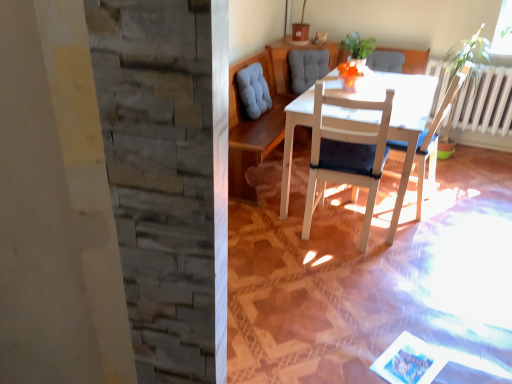
Locate an element on the screen. Image resolution: width=512 pixels, height=384 pixels. white wood table at center is located at coordinates (406, 110).

Where is `white wood chair at center, which appears as the 1th chair when viewed from the right`? The image size is (512, 384). white wood chair at center, which appears as the 1th chair when viewed from the right is located at coordinates (435, 136).

What is the approximate width of green leafy plant at upper center?

green leafy plant at upper center is 10.26 inches wide.

Identify the location of white wood table at center. (406, 110).

Does white wood table at center contain green leafy plant at upper center?

No, white wood table at center does not contain green leafy plant at upper center.

Is white wood table at center aimed at green leafy plant at upper center?

No, white wood table at center is not turned towards green leafy plant at upper center.

How much distance is there between white wood chair at center, which is counted as the first chair, starting from the left, and white wood table at center?

They are 8.35 inches apart.

Is white wood chair at center, which is counted as the first chair, starting from the left, taller than white wood table at center?

Indeed, white wood chair at center, which is counted as the first chair, starting from the left, has a greater height compared to white wood table at center.

From the image's perspective, between white wood chair at center, which is counted as the first chair, starting from the left, and white wood table at center, which one is located above?

white wood table at center.

Between white wood chair at center, which is counted as the first chair, starting from the left, and white wood table at center, which one is positioned behind?

white wood table at center is further from the camera.

Is white wood table at center in contact with white wood chair at center, acting as the second chair starting from the left?

No, white wood table at center is not with white wood chair at center, acting as the second chair starting from the left.

Which is more to the left, white wood table at center or white wood chair at center, which appears as the 1th chair when viewed from the right?

white wood table at center.

From a real-world perspective, between white wood table at center and white wood chair at center, acting as the second chair starting from the left, who is vertically lower?

white wood table at center.

Considering their positions, is white wood table at center located in front of or behind white wood chair at center, which appears as the 1th chair when viewed from the right?

Visually, white wood table at center is located in front of white wood chair at center, which appears as the 1th chair when viewed from the right.

Considering the relative positions of white wood chair at center, placed as the second chair when sorted from right to left, and white wood chair at center, acting as the second chair starting from the left, in the image provided, is white wood chair at center, placed as the second chair when sorted from right to left, to the left or to the right of white wood chair at center, acting as the second chair starting from the left,?

white wood chair at center, placed as the second chair when sorted from right to left, is to the left of white wood chair at center, acting as the second chair starting from the left.

Is white wood chair at center, which is counted as the first chair, starting from the left, bigger than white wood chair at center, which appears as the 1th chair when viewed from the right?

Yes.

Measure the distance between white wood chair at center, which is counted as the first chair, starting from the left, and white wood chair at center, acting as the second chair starting from the left.

A distance of 17.53 inches exists between white wood chair at center, which is counted as the first chair, starting from the left, and white wood chair at center, acting as the second chair starting from the left.

Is white wood chair at center, which is counted as the first chair, starting from the left, far away from white wood chair at center, acting as the second chair starting from the left?

white wood chair at center, which is counted as the first chair, starting from the left, is near white wood chair at center, acting as the second chair starting from the left, not far away.

From the image's perspective, which one is positioned higher, green leafy plant at upper center or white wood chair at center, acting as the second chair starting from the left?

green leafy plant at upper center, from the image's perspective.

From a real-world perspective, is green leafy plant at upper center over white wood chair at center, acting as the second chair starting from the left?

Yes, from a real-world perspective, green leafy plant at upper center is above white wood chair at center, acting as the second chair starting from the left.

What are the coordinates of `the 1st chair below the green leafy plant at upper center (from the image's perspective)` in the screenshot? It's located at pos(435,136).

Is white wood chair at center, which appears as the 1th chair when viewed from the right, located outside green leafy plant at upper center?

white wood chair at center, which appears as the 1th chair when viewed from the right, is positioned outside green leafy plant at upper center.

From a real-world perspective, does white wood chair at center, which appears as the 1th chair when viewed from the right, sit lower than green leafy plant at upper center?

Indeed, from a real-world perspective, white wood chair at center, which appears as the 1th chair when viewed from the right, is positioned beneath green leafy plant at upper center.

Is the depth of white wood table at center greater than that of white wood chair at center, placed as the second chair when sorted from right to left?

Yes.

Can you confirm if white wood table at center is thinner than white wood chair at center, which is counted as the first chair, starting from the left?

Incorrect, the width of white wood table at center is not less than that of white wood chair at center, which is counted as the first chair, starting from the left.

Can you confirm if white wood table at center is taller than white wood chair at center, which is counted as the first chair, starting from the left?

In fact, white wood table at center may be shorter than white wood chair at center, which is counted as the first chair, starting from the left.

Where is `table below the green leafy plant at upper center (from a real-world perspective)`? This screenshot has width=512, height=384. table below the green leafy plant at upper center (from a real-world perspective) is located at coordinates (406, 110).

Image resolution: width=512 pixels, height=384 pixels. Find the location of `table on the right of the white wood chair at center, placed as the second chair when sorted from right to left`. table on the right of the white wood chair at center, placed as the second chair when sorted from right to left is located at coordinates (406, 110).

Estimate the real-world distances between objects in this image. Which object is closer to white wood table at center, green leafy plant at upper center or white wood chair at center, which appears as the 1th chair when viewed from the right?

white wood chair at center, which appears as the 1th chair when viewed from the right, is positioned closer to the anchor white wood table at center.

From the image, which object appears to be farther from white wood chair at center, acting as the second chair starting from the left, white wood chair at center, placed as the second chair when sorted from right to left, or white wood table at center?

white wood chair at center, placed as the second chair when sorted from right to left, is positioned further to the anchor white wood chair at center, acting as the second chair starting from the left.

Estimate the real-world distances between objects in this image. Which object is closer to white wood table at center, white wood chair at center, acting as the second chair starting from the left, or green leafy plant at upper center?

white wood chair at center, acting as the second chair starting from the left, is positioned closer to the anchor white wood table at center.

Looking at the image, which one is located further to white wood chair at center, which appears as the 1th chair when viewed from the right, white wood table at center or white wood chair at center, placed as the second chair when sorted from right to left?

The object further to white wood chair at center, which appears as the 1th chair when viewed from the right, is white wood chair at center, placed as the second chair when sorted from right to left.

When comparing their distances from green leafy plant at upper center, does white wood chair at center, placed as the second chair when sorted from right to left, or white wood table at center seem closer?

white wood table at center lies closer to green leafy plant at upper center than the other object.

Based on their spatial positions, is white wood chair at center, acting as the second chair starting from the left, or white wood table at center closer to white wood chair at center, which is counted as the first chair, starting from the left?

Based on the image, white wood table at center appears to be nearer to white wood chair at center, which is counted as the first chair, starting from the left.

Based on their spatial positions, is green leafy plant at upper center or white wood chair at center, placed as the second chair when sorted from right to left, further from white wood table at center?

green leafy plant at upper center is positioned further to the anchor white wood table at center.

Based on their spatial positions, is white wood chair at center, which appears as the 1th chair when viewed from the right, or white wood chair at center, which is counted as the first chair, starting from the left, further from white wood table at center?

white wood chair at center, which appears as the 1th chair when viewed from the right, is further to white wood table at center.

This screenshot has height=384, width=512. What are the coordinates of `chair between white wood chair at center, which is counted as the first chair, starting from the left, and green leafy plant at upper center in the front-back direction` in the screenshot? It's located at (435, 136).

In order to click on table situated between white wood chair at center, placed as the second chair when sorted from right to left, and white wood chair at center, which appears as the 1th chair when viewed from the right, from left to right in this screenshot , I will do `click(406, 110)`.

Where is `table between white wood chair at center, which is counted as the first chair, starting from the left, and green leafy plant at upper center in the front-back direction`? table between white wood chair at center, which is counted as the first chair, starting from the left, and green leafy plant at upper center in the front-back direction is located at coordinates (406, 110).

Where is `chair between green leafy plant at upper center and white wood table at center in the up-down direction`? The height and width of the screenshot is (384, 512). chair between green leafy plant at upper center and white wood table at center in the up-down direction is located at coordinates (435, 136).